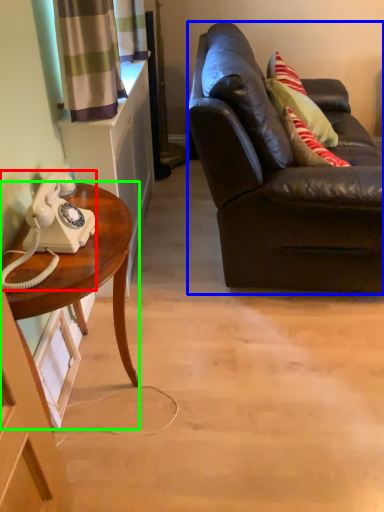
Question: Estimate the real-world distances between objects in this image. Which object is closer to corded phone (highlighted by a red box), studio couch (highlighted by a blue box) or desk (highlighted by a green box)?

Choices:
 (A) studio couch
 (B) desk

Answer: (B)